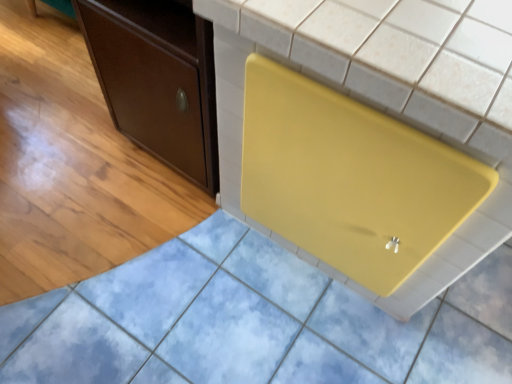
Where is `vacant space in front of matte brown cabinet at left`? vacant space in front of matte brown cabinet at left is located at coordinates (168, 236).